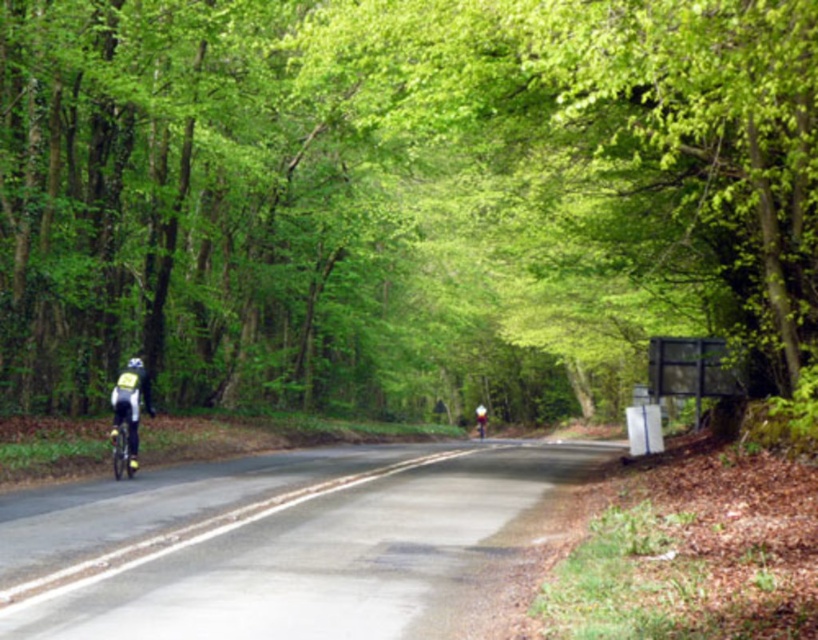
Between point (691, 113) and point (136, 356), which one is positioned in front?

Point (691, 113) is more forward.

Between point (527, 406) and point (135, 368), which one is positioned behind?

Positioned behind is point (527, 406).

Locate an element on the screen. Image resolution: width=818 pixels, height=640 pixels. green leafy tree at center is located at coordinates (401, 198).

Who is taller, matte black helmet at center or white matte bicycle helmet at left?

With more height is matte black helmet at center.

Is point (479, 422) in front of point (129, 358)?

No, it is not.

I want to click on matte black helmet at center, so click(x=479, y=419).

Is point (673, 280) positioned in front of point (475, 410)?

Yes, it is in front of point (475, 410).

I want to click on green leafy tree at center, so click(x=401, y=198).

At what (x,y) coordinates should I click in order to perform the action: click on green leafy tree at center. Please return your answer as a coordinate pair (x, y). Looking at the image, I should click on point(401,198).